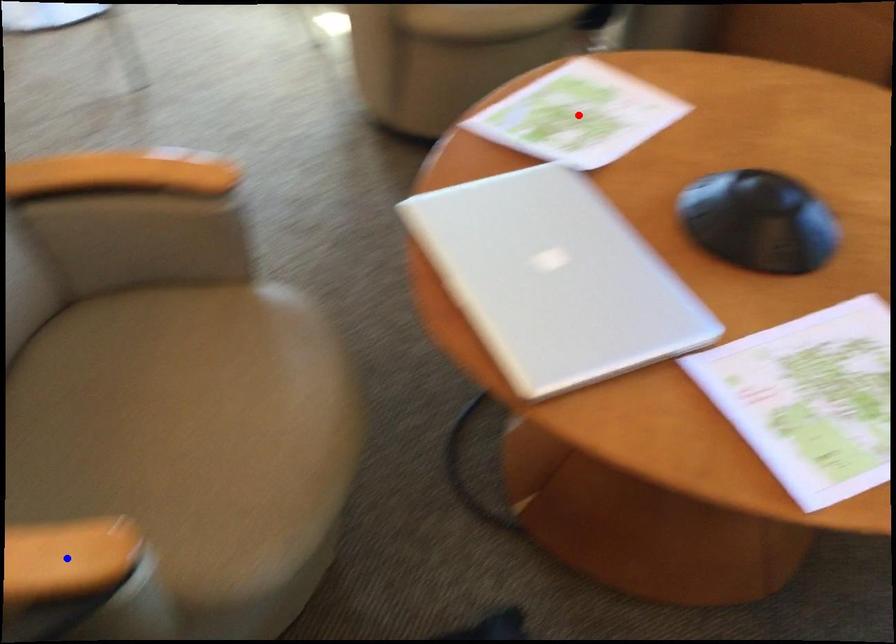
Question: Which of the two points in the image is closer to the camera?

Choices:
 (A) Blue point is closer.
 (B) Red point is closer.

Answer: (A)